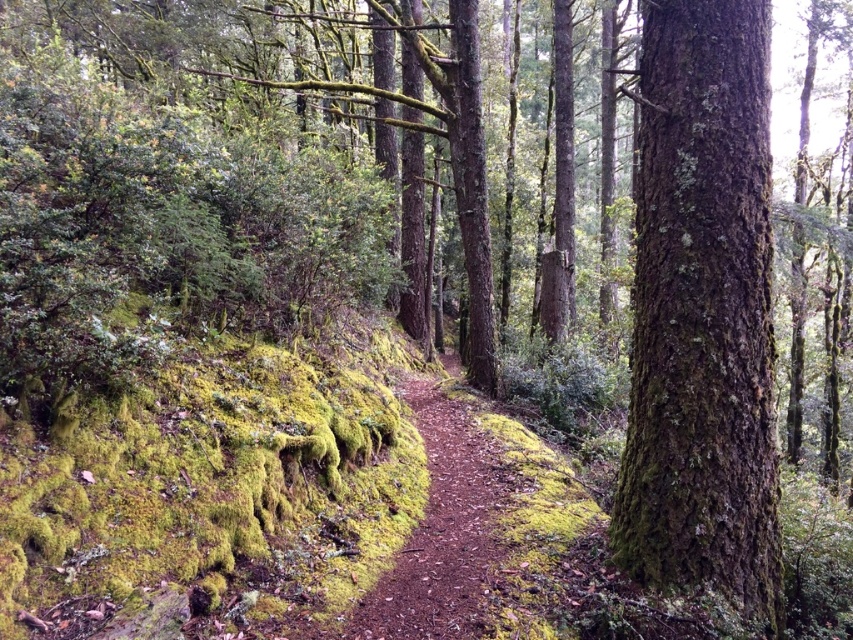
Identify the location of green mossy bark tree at center. (701, 314).

Who is positioned more to the left, green mossy bark tree at center or brown dirt path at center?

From the viewer's perspective, brown dirt path at center appears more on the left side.

Find the location of a particular element. This screenshot has height=640, width=853. green mossy bark tree at center is located at coordinates (701, 314).

Where is `green mossy bark tree at center`? green mossy bark tree at center is located at coordinates (701, 314).